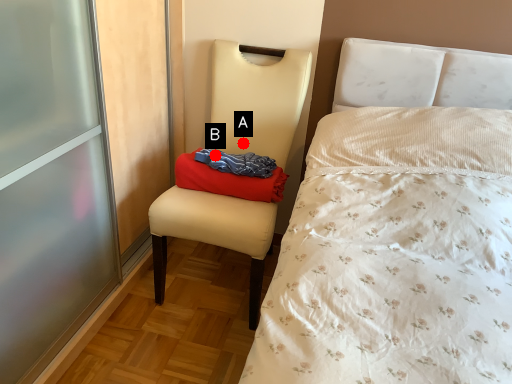
Question: Two points are circled on the image, labeled by A and B beside each circle. Which point is closer to the camera taking this photo?

Choices:
 (A) A is closer
 (B) B is closer

Answer: (B)